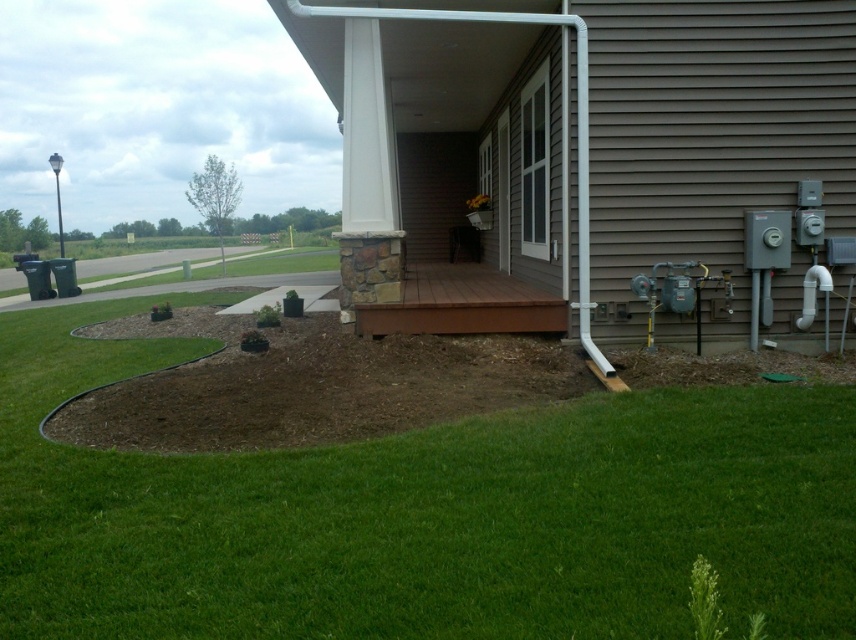
Between green grass at lower center and brown wood deck at center, which one is positioned lower?

green grass at lower center is below.

Can you confirm if green grass at lower center is shorter than brown wood deck at center?

Yes.

Who is more forward, (851, 525) or (437, 310)?

Positioned in front is point (851, 525).

At what (x,y) coordinates should I click in order to perform the action: click on green grass at lower center. Please return your answer as a coordinate pair (x, y). Image resolution: width=856 pixels, height=640 pixels. Looking at the image, I should click on (423, 515).